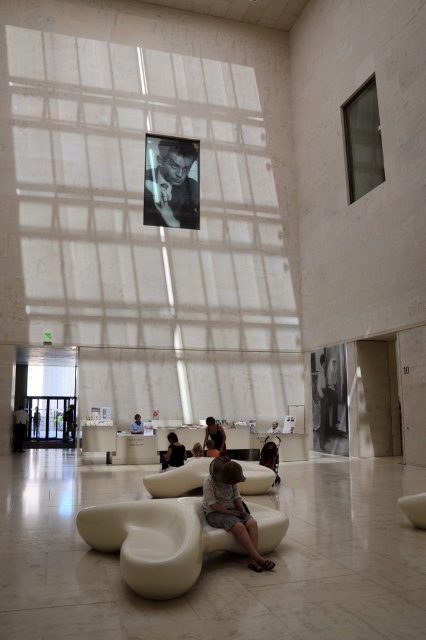
Question: Which of the following is the closest to the observer?

Choices:
 (A) light brown wooden chair at center
 (B) matte beige couch at center
 (C) dark hair person at center
 (D) dark gray fabric chair at center

Answer: (B)

Question: Among these points, which one is farthest from the camera?

Choices:
 (A) (186, 170)
 (B) (219, 435)
 (C) (233, 534)
 (D) (22, 436)

Answer: (D)

Question: Does dark gray fabric couch at center have a smaller size compared to dark hair person at center?

Choices:
 (A) no
 (B) yes

Answer: (A)

Question: Can you confirm if dark gray fabric jacket at center is positioned below smooth beige couch at center?

Choices:
 (A) yes
 (B) no

Answer: (B)

Question: Where is black and white photograph of a man at upper center located in relation to dark gray fabric couch at center in the image?

Choices:
 (A) above
 (B) below

Answer: (A)

Question: Which object is farther from the camera taking this photo?

Choices:
 (A) matte beige couch at center
 (B) black and white photograph of a man at upper center
 (C) dark gray fabric couch at center
 (D) dark hair person at center

Answer: (C)